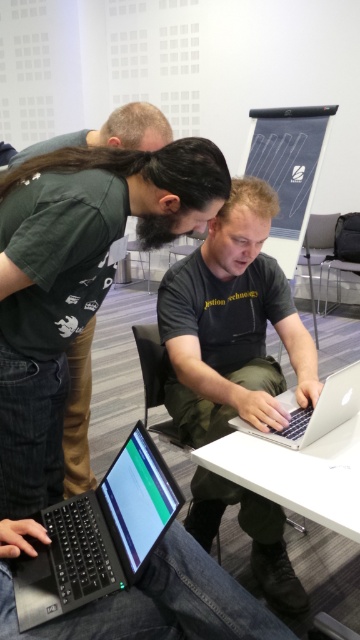
You are a visitor in the office and want to borrow a laptop. There are two laptops available, the matte black laptop at lower left and the matte black laptop at center. Which one is physically nearer to you?

The matte black laptop at lower left is closer to the viewer than the matte black laptop at center, so the matte black laptop at lower left is physically nearer to you.

You are a new employee in the office and need to use the largest laptop available. Which one should you choose between the matte black laptop at center and the black matte laptop at lower left?

The matte black laptop at center is larger in size compared to the black matte laptop at lower left, so you should choose the matte black laptop at center.